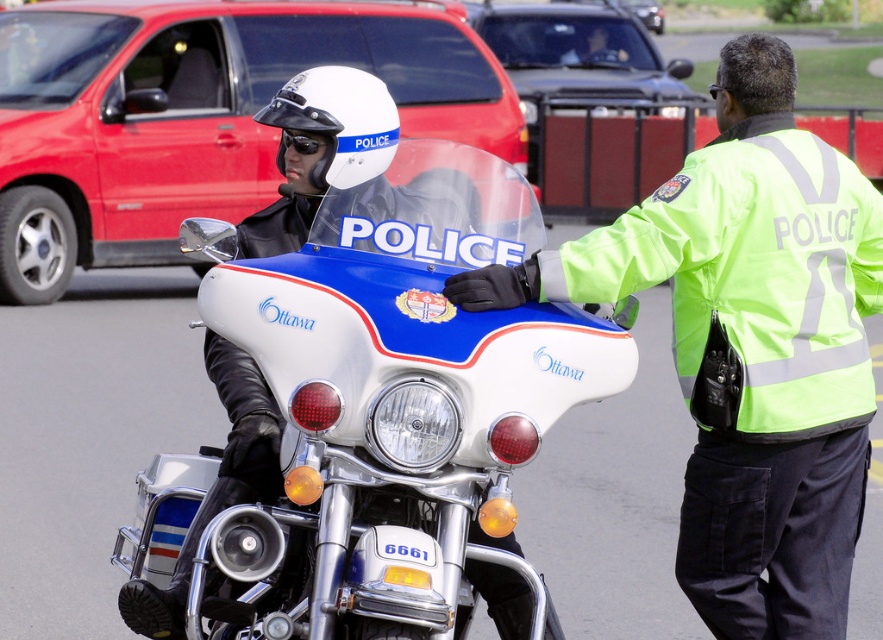
You are a pedestrian standing on the sidewalk and see the white glossy police motorcycle at center and the neon green reflective jacket at right. Which object is closer to your left side?

The white glossy police motorcycle at center is closer to your left side because it is positioned to the left of the neon green reflective jacket at right.

From the picture: You are a delivery driver who needs to park your van near the white glossy police motorcycle at center. The parking spot is marked at point [380,413]. Can you safely park your van there without blocking the motorcycle?

The white glossy police motorcycle at center is located at point [380,413], so parking your van there would block the motorcycle. Please choose another spot.